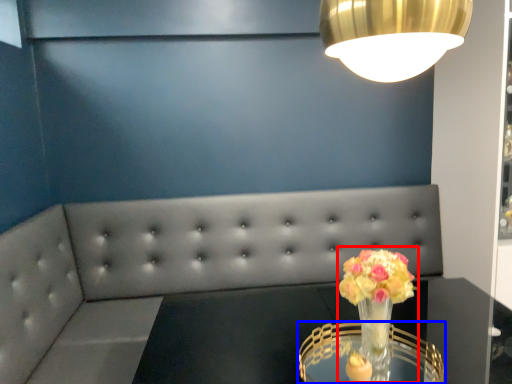
Question: Which object appears closest to the camera in this image, floral arrangement (highlighted by a red box) or table (highlighted by a blue box)?

Choices:
 (A) floral arrangement
 (B) table

Answer: (B)